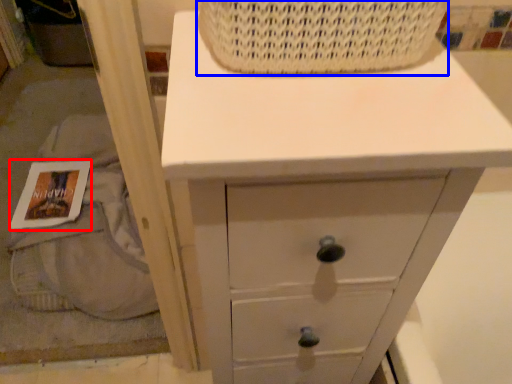
Question: Which object is closer to the camera taking this photo, magazine (highlighted by a red box) or basket (highlighted by a blue box)?

Choices:
 (A) magazine
 (B) basket

Answer: (B)